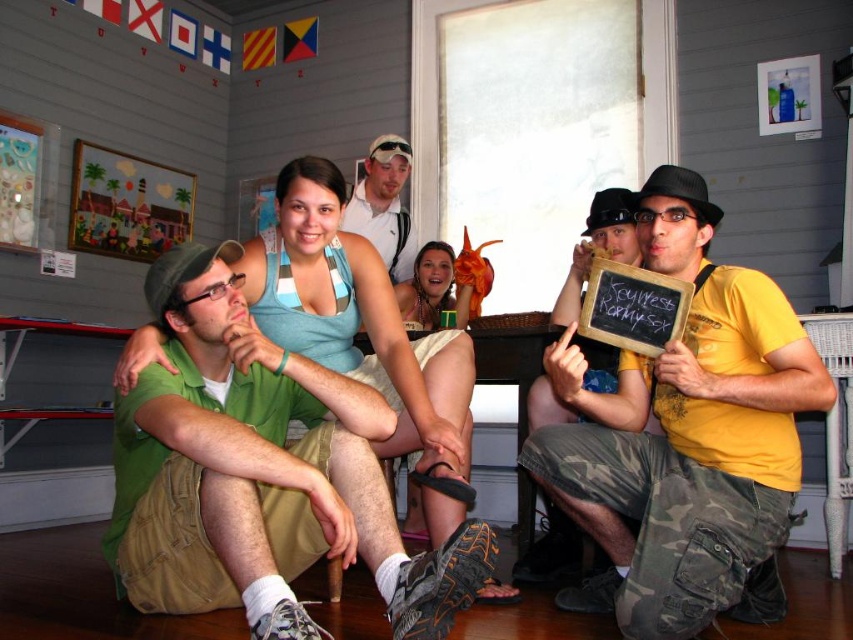
Based on the scene described, can you determine the spatial relationship between the yellow matte shirt at center and the white cotton shirt at upper center?

The yellow matte shirt at center is positioned to the right of the white cotton shirt at upper center.

Based on the scene description, where is the yellow matte shirt at center located in terms of coordinates?

The yellow matte shirt at center is located at the coordinates point [685,436].

You are a photographer trying to adjust the lighting for a group photo. You notice the white cotton shirt at upper center and the smooth tan skin at center. Which of these two is located more to the left in the frame?

The white cotton shirt at upper center is positioned on the left side of smooth tan skin at center, so it is more to the left.